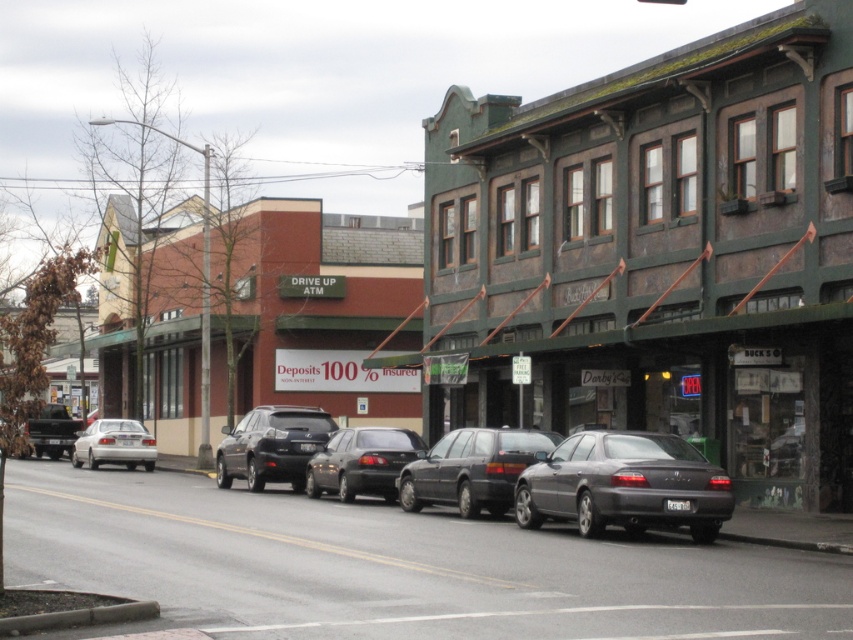
From the picture: Between matte gray sedan at center and matte black station wagon at center, which one has less height?

matte gray sedan at center is shorter.

Does matte gray sedan at center appear on the left side of matte black station wagon at center?

In fact, matte gray sedan at center is to the right of matte black station wagon at center.

What do you see at coordinates (624, 484) in the screenshot?
I see `matte gray sedan at center` at bounding box center [624, 484].

Locate an element on the screen. matte gray sedan at center is located at coordinates (624, 484).

Who is more distant from viewer, (286, 433) or (392, 484)?

The point (286, 433) is more distant.

Can you confirm if matte black suv at center is thinner than shiny black sedan at center?

No.

Is point (274, 465) positioned behind point (366, 480)?

Yes, point (274, 465) is behind point (366, 480).

The height and width of the screenshot is (640, 853). What are the coordinates of `matte black suv at center` in the screenshot? It's located at (271, 445).

Is matte gray sedan at center shorter than shiny black sedan at center?

In fact, matte gray sedan at center may be taller than shiny black sedan at center.

Does point (578, 481) lie behind point (308, 492)?

No.

This screenshot has height=640, width=853. I want to click on matte gray sedan at center, so click(624, 484).